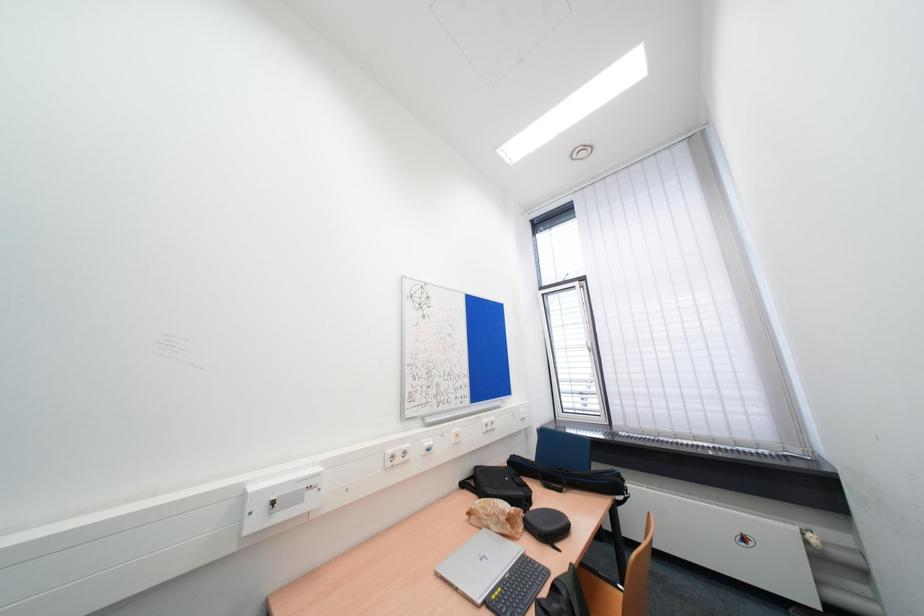
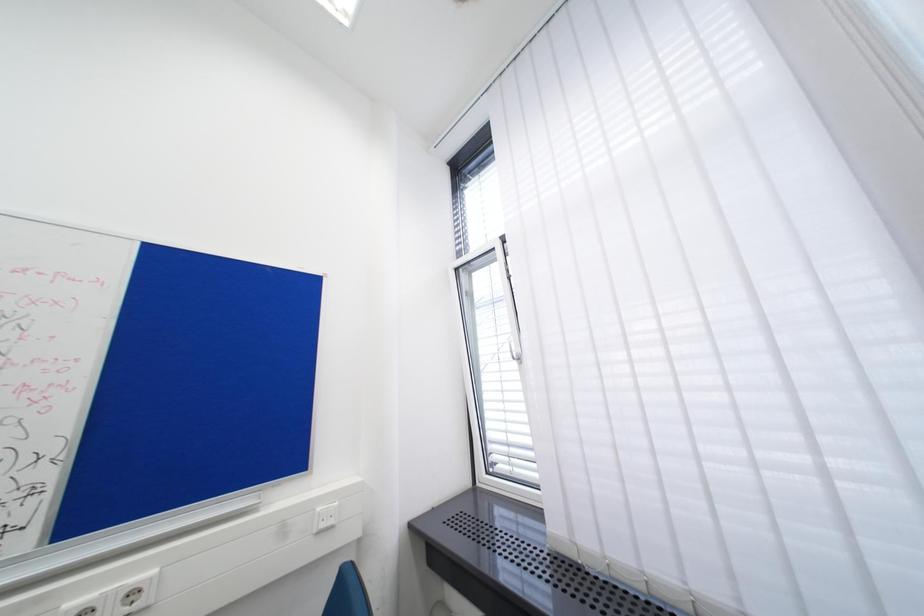
The images are taken continuously from a first-person perspective. In which direction are you moving?

The cameraman moved toward right, forward.